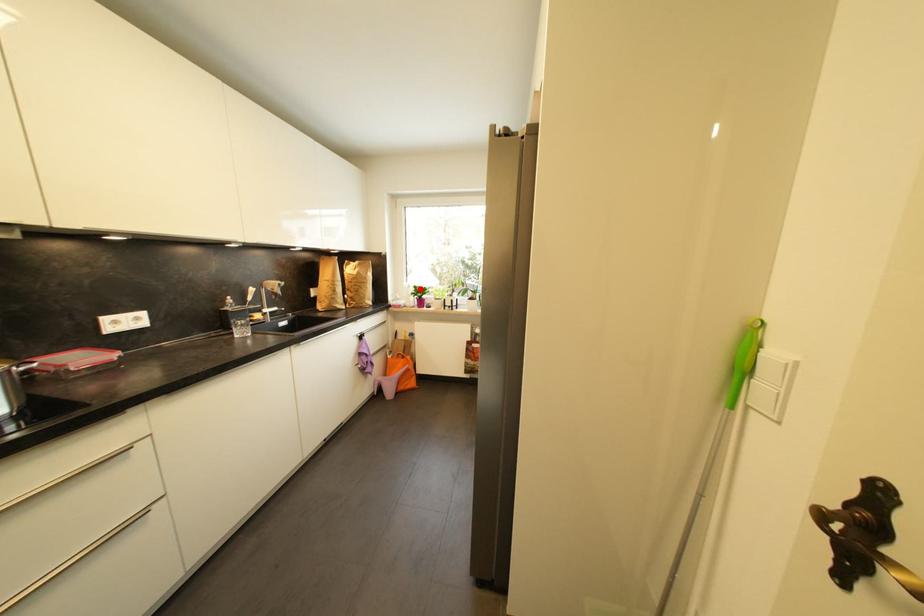
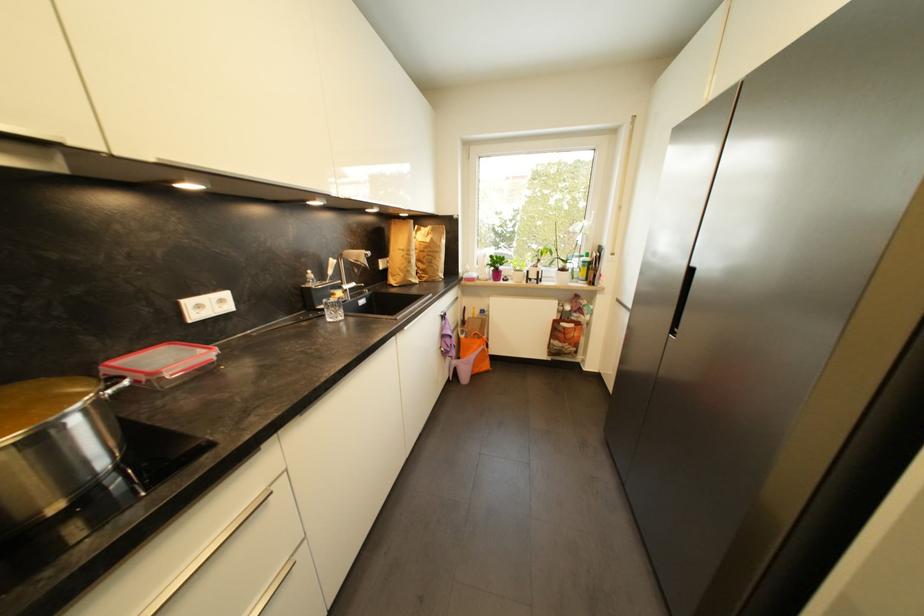
Find the pixel in the second image that matches the highlighted location in the first image.

(495, 257)